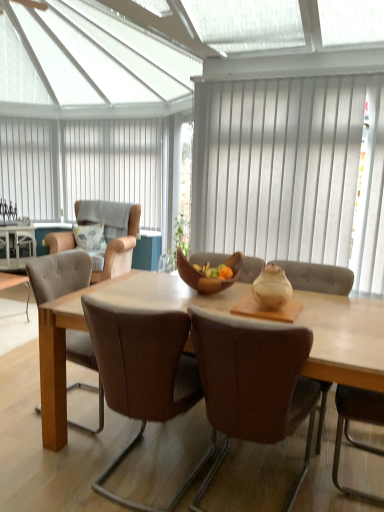
Question: In terms of height, does brown leather chair at center, which is counted as the third chair, starting from the back, look taller or shorter compared to brown leather chair at center, which is the first chair in front-to-back order?

Choices:
 (A) tall
 (B) short

Answer: (B)

Question: Based on their sizes in the image, would you say brown leather chair at center, which is the second chair from front to back, is bigger or smaller than brown leather chair at center, which is the first chair in front-to-back order?

Choices:
 (A) big
 (B) small

Answer: (A)

Question: Based on their relative distances, which object is nearer to the light brown wooden table at center?

Choices:
 (A) beige fabric armchair at left, positioned as the 1th chair in back-to-front order
 (B) white vertical blinds at upper center, arranged as the 1th curtain when viewed from the left
 (C) brown leather table at lower left
 (D) white textured curtain at center, positioned as the first curtain in right-to-left order
 (E) brown wooden bowl at center

Answer: (E)

Question: Which of these objects is positioned closest to the brown wooden bowl at center?

Choices:
 (A) white textured curtain at center, positioned as the 2th curtain in back-to-front order
 (B) brown leather chair at center, which is the second chair from front to back
 (C) brown leather chair at left, the 2th chair in the back-to-front sequence
 (D) light brown wooden table at center
 (E) fluffy fabric pillow at upper left

Answer: (D)